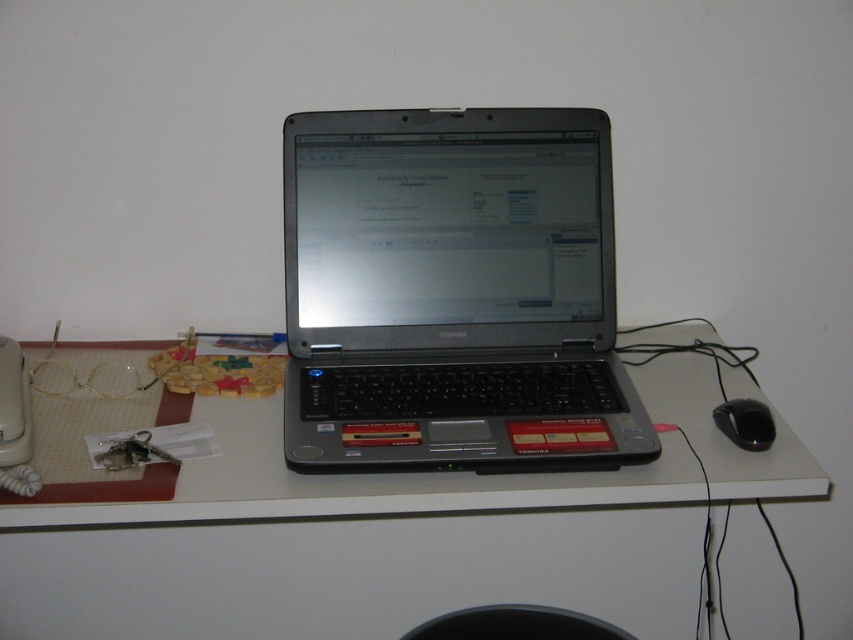
Who is higher up, satin silver laptop at center or black plastic trash can at lower center?

satin silver laptop at center is higher up.

Does satin silver laptop at center appear on the left side of black plastic trash can at lower center?

Correct, you'll find satin silver laptop at center to the left of black plastic trash can at lower center.

The image size is (853, 640). Identify the location of satin silver laptop at center. (453, 292).

In order to click on satin silver laptop at center in this screenshot , I will do (453, 292).

I want to click on white matte computer desk at center, so click(x=354, y=545).

Does white matte computer desk at center have a lesser height compared to satin silver laptop at center?

Yes.

Does point (73, 525) come farther from viewer compared to point (585, 305)?

Yes, point (73, 525) is farther from viewer.

Locate an element on the screen. white matte computer desk at center is located at coordinates (354, 545).

Does black plastic trash can at lower center lie behind black plastic mouse at lower right?

No, black plastic trash can at lower center is in front of black plastic mouse at lower right.

Which is in front, point (459, 628) or point (758, 422)?

Point (459, 628) is more forward.

Is point (442, 632) behind point (751, 416)?

No, (442, 632) is closer to viewer.

This screenshot has width=853, height=640. I want to click on black plastic trash can at lower center, so click(x=515, y=625).